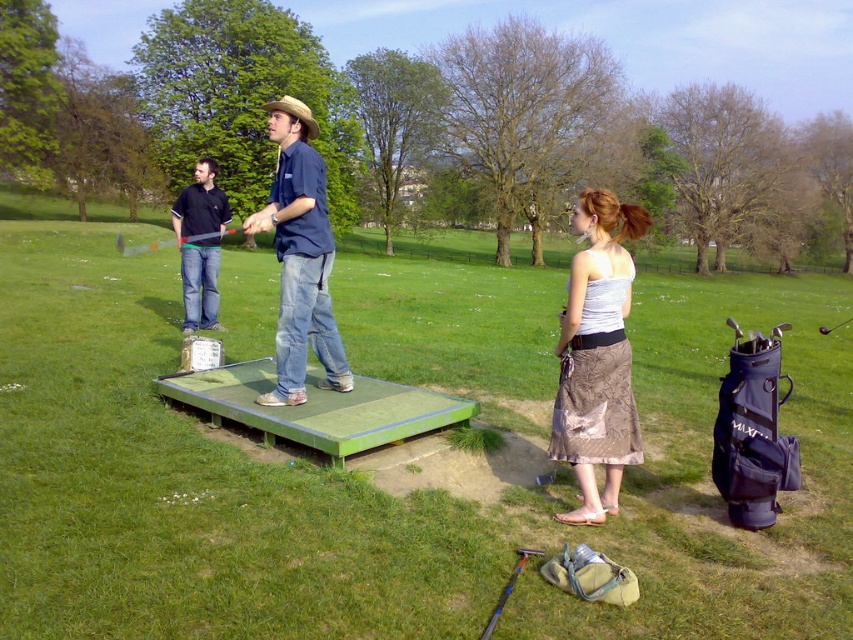
Question: Which point is farther to the camera?

Choices:
 (A) silky brown skirt at lower right
 (B) denim jeans at center

Answer: (B)

Question: Considering the real-world distances, which object is farthest from the green rubber mat at center?

Choices:
 (A) metallic silver golf club at center
 (B) denim jeans at center
 (C) silky brown skirt at lower right
 (D) matte black shirt at left

Answer: (C)

Question: Is silky brown skirt at lower right smaller than denim jeans at center?

Choices:
 (A) no
 (B) yes

Answer: (B)

Question: Does denim jeans at center appear under metallic silver golf club at center?

Choices:
 (A) no
 (B) yes

Answer: (B)

Question: Does silky brown skirt at lower right have a larger size compared to metallic silver golf club at center?

Choices:
 (A) yes
 (B) no

Answer: (B)

Question: Which object is the closest to the silky brown skirt at lower right?

Choices:
 (A) metallic silver golf club at center
 (B) matte black shirt at left
 (C) green rubber mat at center
 (D) denim jeans at center

Answer: (D)